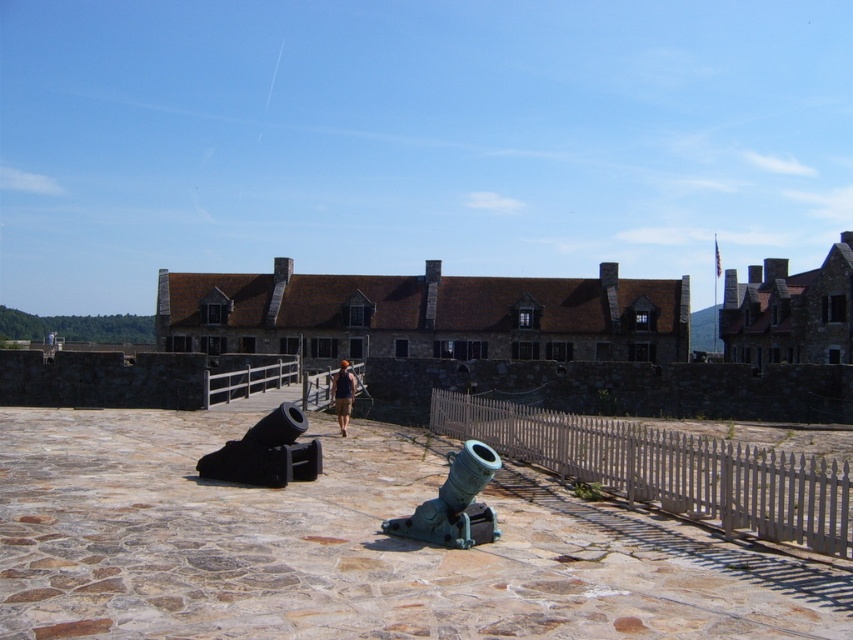
Question: Considering the relative positions of white picket fence at center and black matte cannon at lower left in the image provided, where is white picket fence at center located with respect to black matte cannon at lower left?

Choices:
 (A) right
 (B) left

Answer: (A)

Question: Estimate the real-world distances between objects in this image. Which object is closer to the black matte cannon at lower left?

Choices:
 (A) brown fabric shirt at center
 (B) white picket fence at center
 (C) green patina metal cannon at center

Answer: (C)

Question: Is white picket fence at center wider than brown fabric shirt at center?

Choices:
 (A) yes
 (B) no

Answer: (A)

Question: Which object appears farthest from the camera in this image?

Choices:
 (A) black matte cannon at lower left
 (B) green patina metal cannon at center
 (C) white picket fence at center

Answer: (A)

Question: Which point is closer to the camera?

Choices:
 (A) green patina metal cannon at center
 (B) black matte cannon at lower left
 (C) white picket fence at center

Answer: (C)

Question: Can you confirm if green patina metal cannon at center is positioned to the right of brown fabric shirt at center?

Choices:
 (A) no
 (B) yes

Answer: (B)